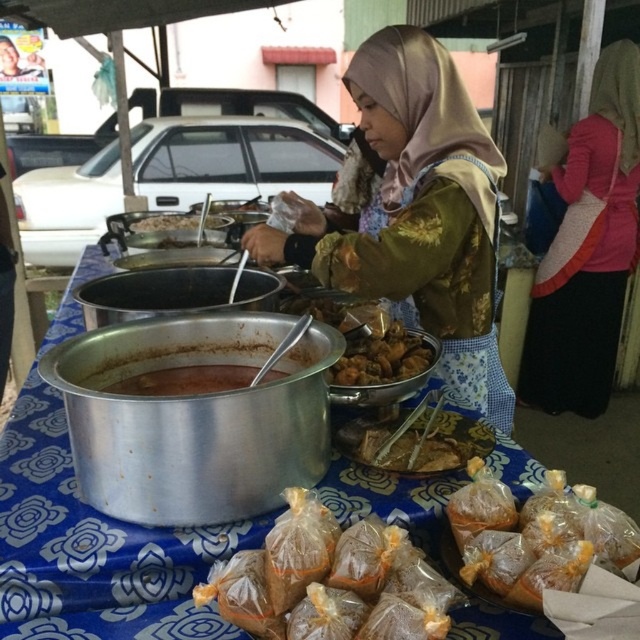
Question: Which of the following is the closest to the observer?

Choices:
 (A) [440, 275]
 (B) [544, 355]
 (C) [211, 218]

Answer: (A)

Question: Which object is closer to the camera taking this photo?

Choices:
 (A) brown matte bowl at center
 (B) brown matte soup at center

Answer: (B)

Question: Which of the following is the closest to the observer?

Choices:
 (A) (467, 221)
 (B) (276, 348)

Answer: (B)

Question: In this image, where is shiny metallic bowl at center located relative to brown matte bowl at center?

Choices:
 (A) below
 (B) above

Answer: (A)

Question: Does gold metallic dress at center appear on the left side of translucent plastic bags at lower center?

Choices:
 (A) no
 (B) yes

Answer: (A)

Question: From the image, what is the correct spatial relationship of silver metallic table at center in relation to translucent plastic bags at lower center?

Choices:
 (A) left
 (B) right

Answer: (A)